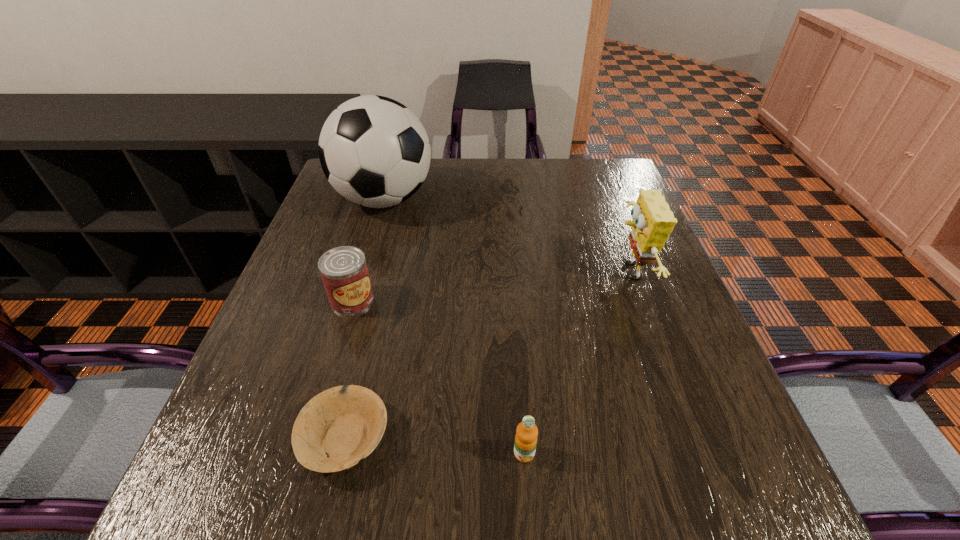
What are the coordinates of `free point between the sponge and the second object from right to left` in the screenshot? It's located at click(576, 363).

Where is `unoccupied position between the can and the bowl`? The width and height of the screenshot is (960, 540). unoccupied position between the can and the bowl is located at coordinates (349, 369).

Image resolution: width=960 pixels, height=540 pixels. In order to click on free point between the farthest object and the rightmost object in this screenshot , I will do `click(506, 236)`.

Locate an element on the screen. free space between the orange juice and the shortest object is located at coordinates (435, 446).

I want to click on vacant area between the orange juice and the soccer ball, so click(454, 326).

This screenshot has width=960, height=540. Find the location of `free spot between the bowl and the can`. free spot between the bowl and the can is located at coordinates [349, 369].

Where is `vacant space that is in between the bowl and the can`? vacant space that is in between the bowl and the can is located at coordinates (349, 369).

Locate which object ranks second in proximity to the second object from right to left. Please provide its 2D coordinates. Your answer should be formatted as a tuple, i.e. [(x, y)], where the tuple contains the x and y coordinates of a point satisfying the conditions above.

[(653, 221)]

Identify which object is the second closest to the bowl. Please provide its 2D coordinates. Your answer should be formatted as a tuple, i.e. [(x, y)], where the tuple contains the x and y coordinates of a point satisfying the conditions above.

[(526, 435)]

Locate an element on the screen. The height and width of the screenshot is (540, 960). free space that satisfies the following two spatial constraints: 1. on the face of the fourth shortest object; 2. on the label of the fourth object from left to right is located at coordinates (695, 453).